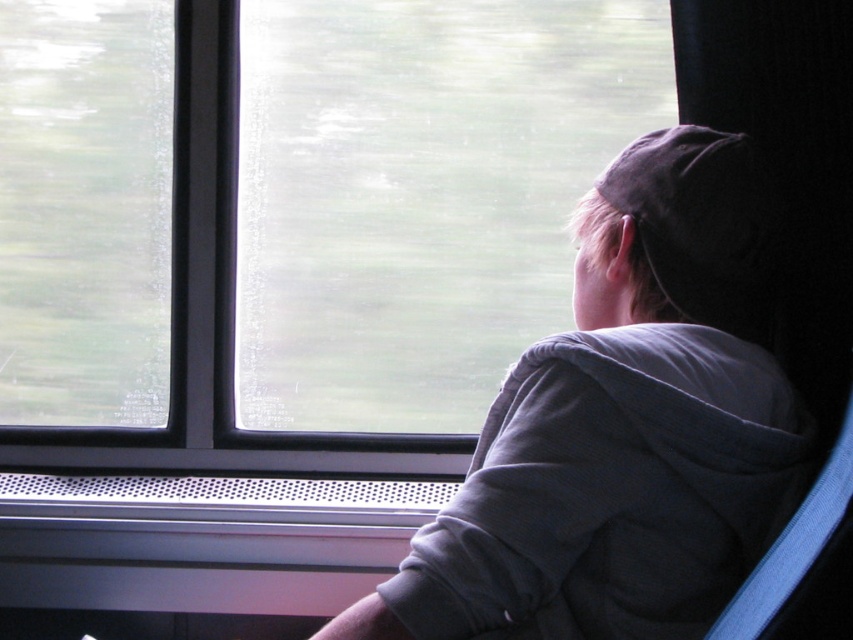
Is gray fleece jacket at upper right behind dark gray fabric baseball hat at upper right?

No, it is in front of dark gray fabric baseball hat at upper right.

Does point (712, 278) come closer to viewer compared to point (660, 145)?

Yes, it is in front of point (660, 145).

Between point (569, 445) and point (662, 150), which one is positioned behind?

Point (662, 150)

Find the location of a particular element. This screenshot has height=640, width=853. gray fleece jacket at upper right is located at coordinates (622, 428).

Can you confirm if transparent glass window at upper left is wider than dark gray fabric baseball hat at upper right?

Yes.

Between point (6, 164) and point (676, 148), which one is positioned behind?

The point (6, 164) is more distant.

This screenshot has width=853, height=640. What are the coordinates of `transparent glass window at upper left` in the screenshot? It's located at (85, 211).

Does gray fleece jacket at upper right have a lesser width compared to transparent glass window at upper left?

No.

Which is above, gray fleece jacket at upper right or transparent glass window at upper left?

Positioned higher is transparent glass window at upper left.

Between point (666, 436) and point (74, 141), which one is positioned in front?

Positioned in front is point (666, 436).

The image size is (853, 640). I want to click on gray fleece jacket at upper right, so click(x=622, y=428).